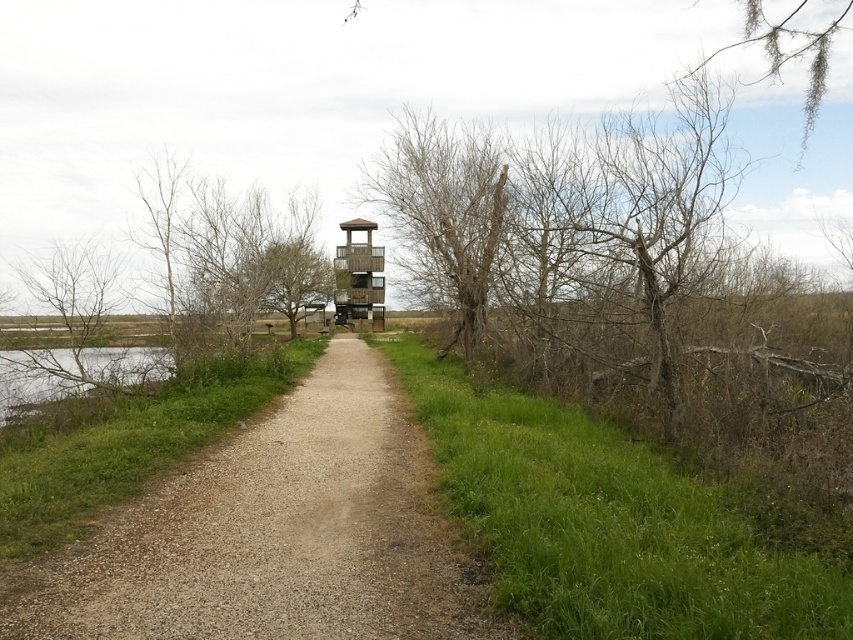
You are a hiker standing at the gravel path leading to the wooden observation tower. You see a bare wood tree at left and a green grassy water at lower left. Which object is located more to the left side?

The bare wood tree at left is more to the left side than the green grassy water at lower left.